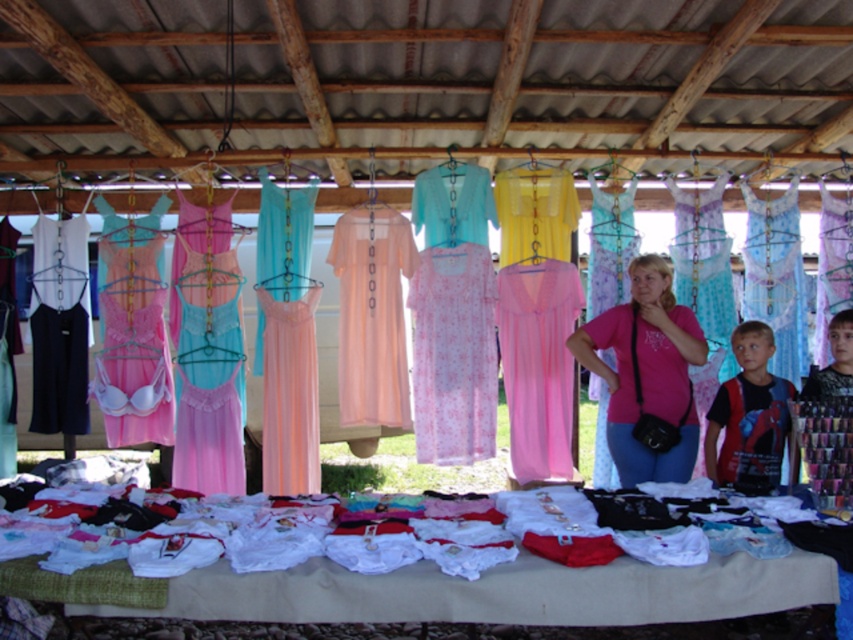
Question: From the image, what is the correct spatial relationship of pink sheer dress at center in relation to pink satin nightgown at center?

Choices:
 (A) left
 (B) right

Answer: (B)

Question: Which object is farther from the camera taking this photo?

Choices:
 (A) pink sheer dress at center
 (B) spiderman t-shirt at center
 (C) light pink sheer dress at center

Answer: (C)

Question: Which point is closer to the camera?

Choices:
 (A) (608, 337)
 (B) (283, 481)
 (C) (469, 280)
 (D) (370, 314)

Answer: (A)

Question: Can you confirm if spiderman t-shirt at center is positioned to the left of smooth black t-shirt at right?

Choices:
 (A) no
 (B) yes

Answer: (B)

Question: Is pink matte t-shirt at center wider than pink satin nightgown at center?

Choices:
 (A) no
 (B) yes

Answer: (B)

Question: Which of the following is the farthest from the observer?

Choices:
 (A) (468, 369)
 (B) (759, 461)
 (C) (657, 257)

Answer: (A)